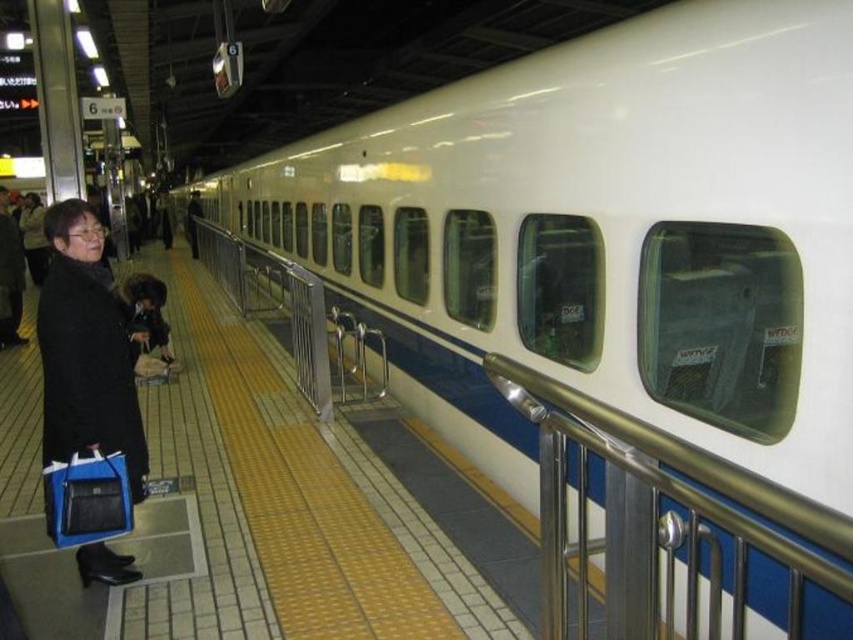
Question: Is satin silver railing at center positioned behind black matte coat at left?

Choices:
 (A) no
 (B) yes

Answer: (A)

Question: Which point appears closest to the camera in this image?

Choices:
 (A) (840, 532)
 (B) (132, 476)

Answer: (A)

Question: Is satin silver railing at center to the left of black matte coat at left from the viewer's perspective?

Choices:
 (A) yes
 (B) no

Answer: (B)

Question: Which point is farther from the camera taking this photo?

Choices:
 (A) (77, 556)
 (B) (505, 364)

Answer: (A)

Question: Does satin silver railing at center appear over black matte coat at left?

Choices:
 (A) yes
 (B) no

Answer: (B)